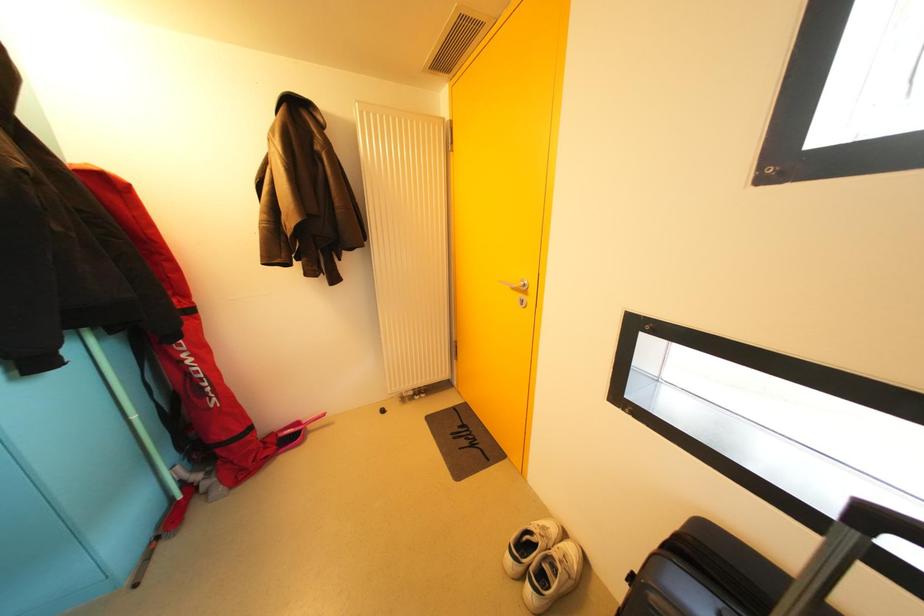
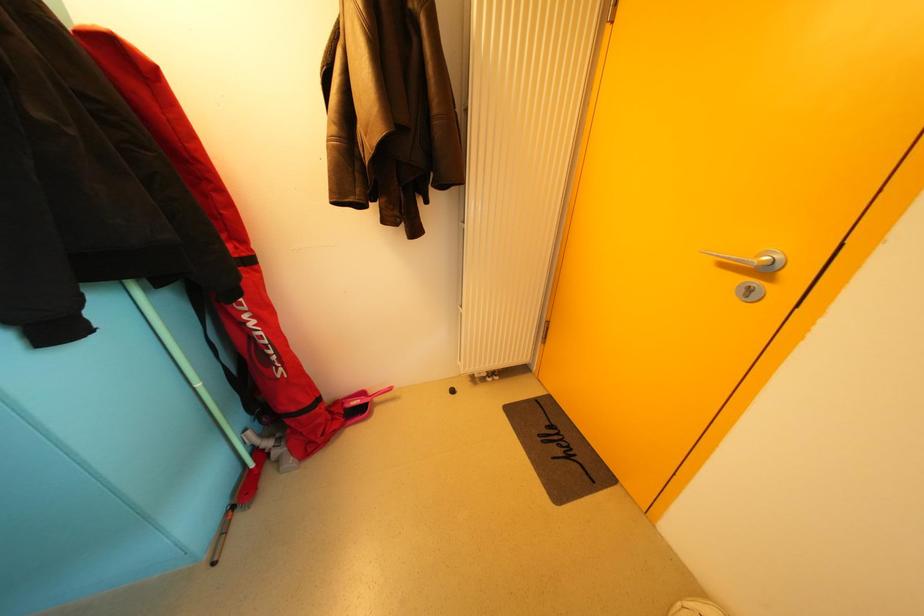
The images are taken continuously from a first-person perspective. In which direction are you moving?

The cameraman walked toward left, forward.